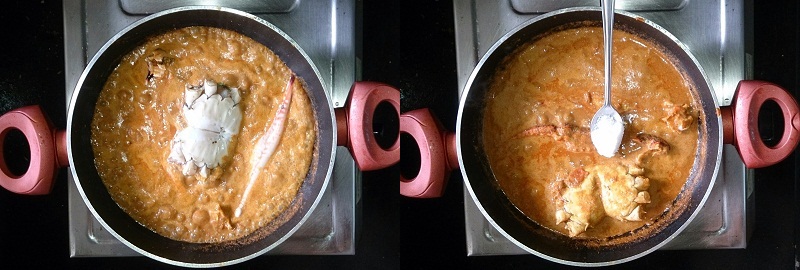
Locate an element on the screen. stovetop is located at coordinates (330, 28), (468, 24).